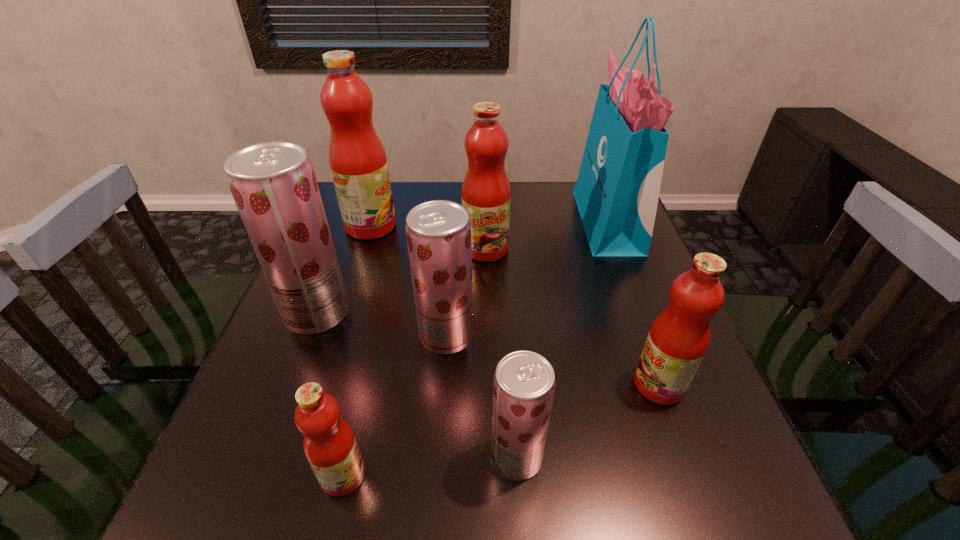
Locate which fruit juice is the second closest to the rightmost pink fruit juice. Please provide its 2D coordinates. Your answer should be formatted as a tuple, i.e. [(x, y)], where the tuple contains the x and y coordinates of a point satisfying the conditions above.

[(438, 232)]

The width and height of the screenshot is (960, 540). Identify the location of fruit juice object that ranks as the sixth closest to the nearest pink fruit juice. (357, 159).

This screenshot has height=540, width=960. Identify the location of pink fruit juice object that ranks as the third closest to the third farthest pink fruit juice. (357, 159).

Identify the location of pink fruit juice that stands as the second closest to the second strawberry fruit juice from right to left. The width and height of the screenshot is (960, 540). (330, 446).

You are a GUI agent. You are given a task and a screenshot of the screen. Output one action in this format:
    pyautogui.click(x=<x>, y=<y>)
    Task: Click on the third closest strawberry fruit juice relative to the fifth farthest fruit juice
    The image size is (960, 540).
    Given the screenshot: What is the action you would take?
    pyautogui.click(x=273, y=184)

Locate an element on the screen. This screenshot has height=540, width=960. strawberry fruit juice that is the second closest to the nearest pink fruit juice is located at coordinates (438, 232).

This screenshot has height=540, width=960. I want to click on vacant space that satisfies the following two spatial constraints: 1. on the front side of the nearest strawberry fruit juice; 2. on the front label of the smallest pink fruit juice, so click(517, 475).

Where is `vacant position in the image that satisfies the following two spatial constraints: 1. on the front side of the blue shopping bag; 2. on the front label of the biggest pink fruit juice`? vacant position in the image that satisfies the following two spatial constraints: 1. on the front side of the blue shopping bag; 2. on the front label of the biggest pink fruit juice is located at coordinates (609, 226).

Identify the location of free location that satisfies the following two spatial constraints: 1. on the front label of the biggest pink fruit juice; 2. on the back side of the second strawberry fruit juice from left to right. The width and height of the screenshot is (960, 540). (335, 335).

This screenshot has height=540, width=960. Identify the location of free space in the image that satisfies the following two spatial constraints: 1. on the front label of the second pink fruit juice from right to left; 2. on the front label of the nearest pink fruit juice. (490, 475).